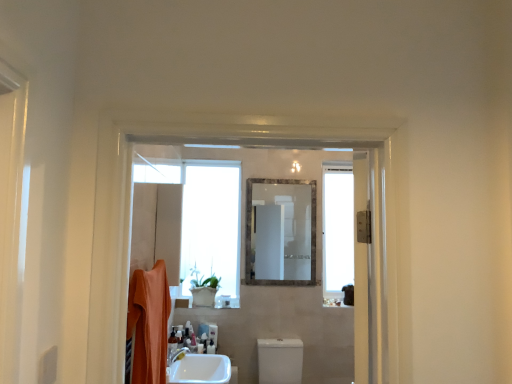
Question: From a real-world perspective, does white glossy toilet at center stand above white glossy tap at lower center?

Choices:
 (A) no
 (B) yes

Answer: (A)

Question: Is white glossy toilet at center closer to camera compared to white glossy tap at lower center?

Choices:
 (A) yes
 (B) no

Answer: (B)

Question: Is white glossy toilet at center positioned beyond the bounds of white glossy tap at lower center?

Choices:
 (A) no
 (B) yes

Answer: (B)

Question: Considering the relative positions of white glossy toilet at center and white glossy tap at lower center in the image provided, is white glossy toilet at center to the right of white glossy tap at lower center from the viewer's perspective?

Choices:
 (A) yes
 (B) no

Answer: (A)

Question: From the image's perspective, is white glossy toilet at center on top of white glossy tap at lower center?

Choices:
 (A) no
 (B) yes

Answer: (A)

Question: From the image's perspective, relative to translucent plastic soap dispenser at lower center, the second toiletry in the front-to-back sequence, is white glossy toilet at center above or below?

Choices:
 (A) below
 (B) above

Answer: (A)

Question: From a real-world perspective, is white glossy toilet at center above or below translucent plastic soap dispenser at lower center, the second toiletry in the front-to-back sequence?

Choices:
 (A) above
 (B) below

Answer: (B)

Question: Would you say white glossy toilet at center is to the left or to the right of translucent plastic soap dispenser at lower center, which is the second toiletry in top-to-bottom order, in the picture?

Choices:
 (A) right
 (B) left

Answer: (A)

Question: Choose the correct answer: Is white glossy toilet at center inside translucent plastic soap dispenser at lower center, the second toiletry in the front-to-back sequence, or outside it?

Choices:
 (A) outside
 (B) inside

Answer: (A)

Question: In the image, is translucent plastic soap dispenser at lower center, the second toiletry in the front-to-back sequence, on the left side or the right side of transparent glass window at right?

Choices:
 (A) left
 (B) right

Answer: (A)

Question: Is translucent plastic soap dispenser at lower center, acting as the first toiletry starting from the right, situated inside transparent glass window at right or outside?

Choices:
 (A) outside
 (B) inside

Answer: (A)

Question: Relative to transparent glass window at right, is translucent plastic soap dispenser at lower center, acting as the first toiletry starting from the right, in front or behind?

Choices:
 (A) behind
 (B) front

Answer: (B)

Question: Is point (209, 342) positioned closer to the camera than point (325, 213)?

Choices:
 (A) closer
 (B) farther

Answer: (A)

Question: Is transparent glass window at right bigger or smaller than silver metallic mirror at center?

Choices:
 (A) small
 (B) big

Answer: (B)

Question: From the image's perspective, is transparent glass window at right located above or below silver metallic mirror at center?

Choices:
 (A) above
 (B) below

Answer: (B)